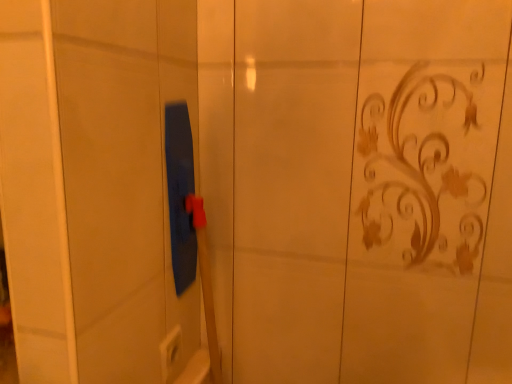
Question: From the image's perspective, is white plastic electric outlet at lower center positioned above or below blue rubber squeegee at center?

Choices:
 (A) above
 (B) below

Answer: (B)

Question: Considering the positions of white plastic electric outlet at lower center and blue rubber squeegee at center in the image, is white plastic electric outlet at lower center wider or thinner than blue rubber squeegee at center?

Choices:
 (A) wide
 (B) thin

Answer: (B)

Question: Looking at the image, does white plastic electric outlet at lower center seem bigger or smaller compared to blue rubber squeegee at center?

Choices:
 (A) big
 (B) small

Answer: (B)

Question: In the image, is blue rubber squeegee at center positioned in front of or behind white plastic electric outlet at lower center?

Choices:
 (A) behind
 (B) front

Answer: (B)

Question: From their relative heights in the image, would you say blue rubber squeegee at center is taller or shorter than white plastic electric outlet at lower center?

Choices:
 (A) tall
 (B) short

Answer: (A)

Question: In the image, is blue rubber squeegee at center on the left side or the right side of white plastic electric outlet at lower center?

Choices:
 (A) right
 (B) left

Answer: (B)

Question: Based on their sizes in the image, would you say blue rubber squeegee at center is bigger or smaller than white plastic electric outlet at lower center?

Choices:
 (A) big
 (B) small

Answer: (A)